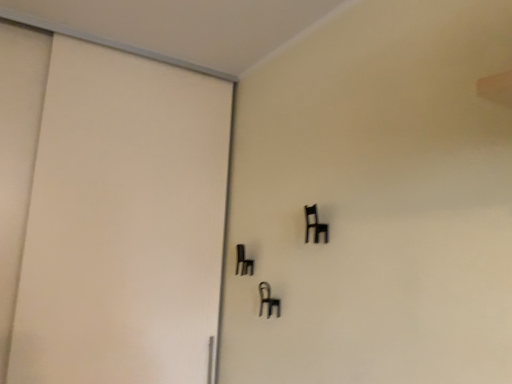
Question: From the image's perspective, is black plastic chair at upper right, which is counted as the 1th furniture, starting from the top, above or below matte white door at left?

Choices:
 (A) below
 (B) above

Answer: (B)

Question: In terms of width, does black plastic chair at upper right, arranged as the third furniture when viewed from the back, look wider or thinner when compared to matte white door at left?

Choices:
 (A) wide
 (B) thin

Answer: (B)

Question: Which is nearer to the black matte chair at center, which is the second furniture in right-to-left order?

Choices:
 (A) black plastic chair at upper right, the 3th furniture from the left
 (B) matte white door at left
 (C) black matte chair at center, the 1th furniture when ordered from left to right

Answer: (C)

Question: Which object is the closest to the matte white door at left?

Choices:
 (A) black matte chair at center, the 2th furniture from the left
 (B) black matte chair at center, the 1th furniture when ordered from left to right
 (C) black plastic chair at upper right, the 1th furniture in the front-to-back sequence

Answer: (B)